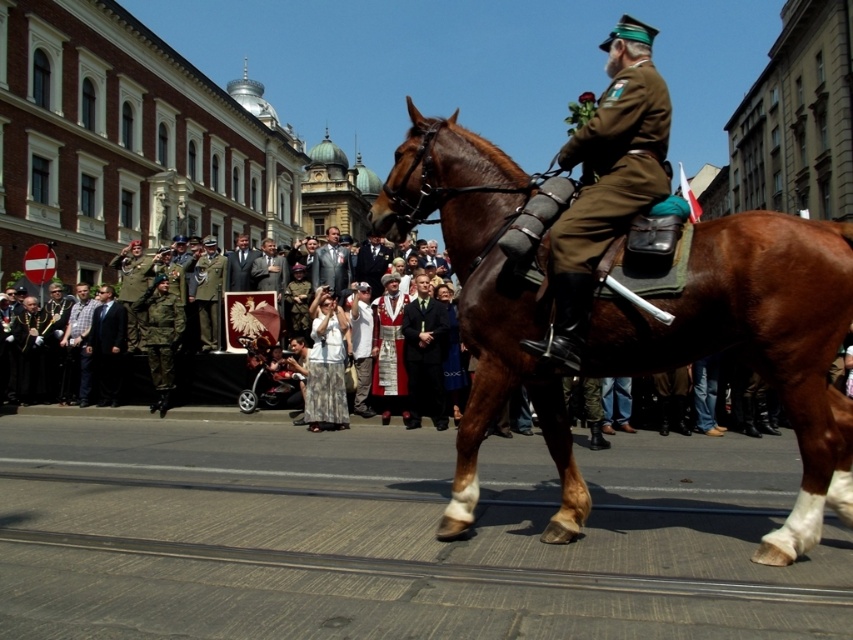
Consider the image. Can you confirm if matte brown uniform at center is positioned below light brown suit at center?

No, matte brown uniform at center is not below light brown suit at center.

Which of these two, matte brown uniform at center or light brown suit at center, stands shorter?

Standing shorter between the two is light brown suit at center.

Does point (585, 289) come closer to viewer compared to point (323, 282)?

Yes, it is.

Locate an element on the screen. The width and height of the screenshot is (853, 640). matte brown uniform at center is located at coordinates (605, 184).

Does point (527, 180) come behind point (321, 250)?

No, it is in front of (321, 250).

Who is shorter, brown glossy horse at center or light brown suit at center?

brown glossy horse at center

Where is `brown glossy horse at center`? brown glossy horse at center is located at coordinates (758, 342).

This screenshot has height=640, width=853. Identify the location of brown glossy horse at center. (758, 342).

Between brown glossy horse at center and matte brown uniform at center, which one has more height?

Standing taller between the two is matte brown uniform at center.

Is brown glossy horse at center to the left of matte brown uniform at center from the viewer's perspective?

Yes, brown glossy horse at center is to the left of matte brown uniform at center.

The image size is (853, 640). Describe the element at coordinates (758, 342) in the screenshot. I see `brown glossy horse at center` at that location.

Find the location of a particular element. The height and width of the screenshot is (640, 853). brown glossy horse at center is located at coordinates (758, 342).